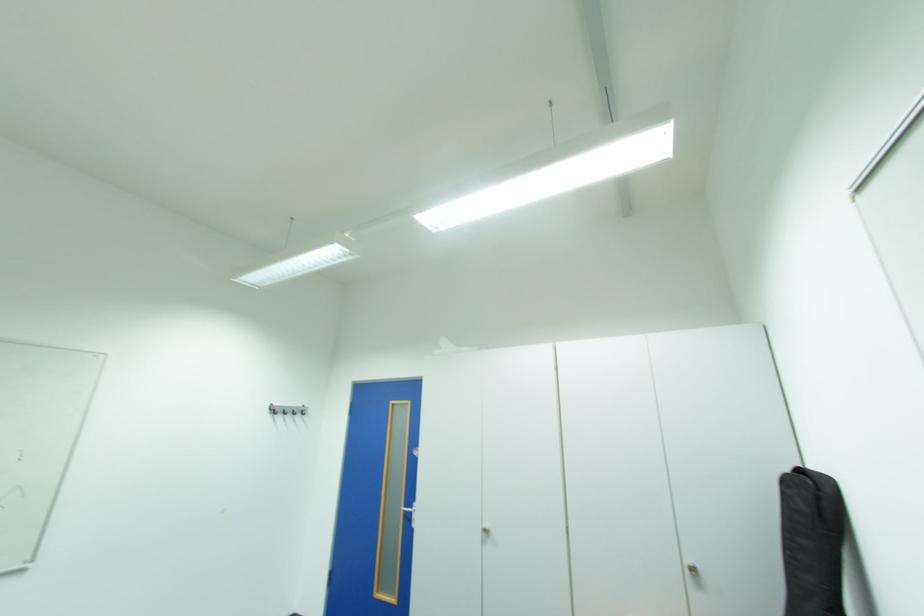
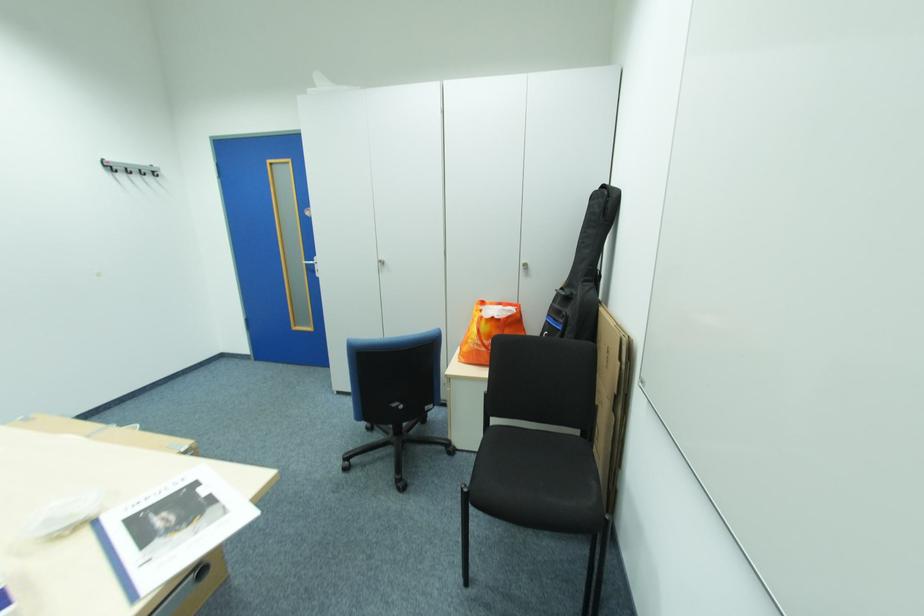
Locate, in the second image, the point that corresponds to (280,411) in the first image.

(114, 171)